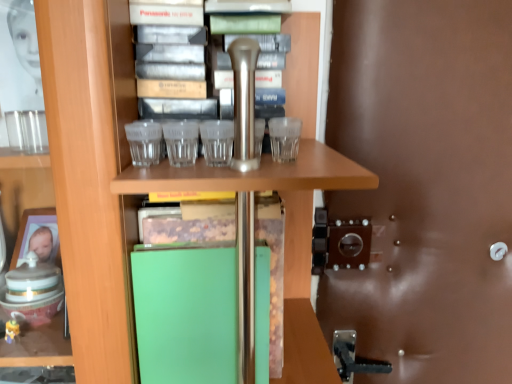
The width and height of the screenshot is (512, 384). What do you see at coordinates (263, 189) in the screenshot?
I see `green matte folder at center` at bounding box center [263, 189].

This screenshot has width=512, height=384. Identify the location of green matte folder at center. (263, 189).

Locate an element on the screen. The height and width of the screenshot is (384, 512). brown leather door at right is located at coordinates [425, 186].

This screenshot has width=512, height=384. What do you see at coordinates (425, 186) in the screenshot?
I see `brown leather door at right` at bounding box center [425, 186].

You are a GUI agent. You are given a task and a screenshot of the screen. Output one action in this format:
    pyautogui.click(x=<x>, y=<y>)
    Task: Click on the green matte folder at center
    
    Given the screenshot: What is the action you would take?
    pyautogui.click(x=263, y=189)

Considering the positions of objects green matte folder at center and brown leather door at right in the image provided, who is more to the left, green matte folder at center or brown leather door at right?

green matte folder at center is more to the left.

Between green matte folder at center and brown leather door at right, which one is positioned in front?

Positioned in front is green matte folder at center.

Considering the points (290, 255) and (468, 263), which point is behind, point (290, 255) or point (468, 263)?

Point (468, 263)

From the image's perspective, is green matte folder at center positioned above or below brown leather door at right?

Based on their image positions, green matte folder at center is located beneath brown leather door at right.

From a real-world perspective, who is located lower, green matte folder at center or brown leather door at right?

green matte folder at center.

Does green matte folder at center have a greater width compared to brown leather door at right?

Yes.

Is green matte folder at center taller or shorter than brown leather door at right?

Clearly, green matte folder at center is shorter compared to brown leather door at right.

Which of these two, green matte folder at center or brown leather door at right, is bigger?

brown leather door at right is bigger.

Is green matte folder at center inside the boundaries of brown leather door at right, or outside?

green matte folder at center lies outside brown leather door at right.

Are green matte folder at center and brown leather door at right far apart?

green matte folder at center is near brown leather door at right, not far away.

Is green matte folder at center facing away from brown leather door at right?

No, green matte folder at center's orientation is not away from brown leather door at right.

How different are the orientations of green matte folder at center and brown leather door at right in degrees?

The angle between the facing direction of green matte folder at center and the facing direction of brown leather door at right is 2.25 degrees.

Identify the location of glass door on the right of green matte folder at center. (425, 186).

Which is more to the right, brown leather door at right or green matte folder at center?

From the viewer's perspective, brown leather door at right appears more on the right side.

Does brown leather door at right come behind green matte folder at center?

Yes, brown leather door at right is further from the camera.

Is point (510, 68) closer to camera compared to point (129, 185)?

No, (510, 68) is further to viewer.

From the image's perspective, is brown leather door at right located above or below green matte folder at center?

Based on their image positions, brown leather door at right is located above green matte folder at center.

From a real-world perspective, is brown leather door at right positioned over green matte folder at center based on gravity?

Yes.

Between brown leather door at right and green matte folder at center, which one has smaller width?

brown leather door at right is thinner.

Is brown leather door at right shorter than green matte folder at center?

No, brown leather door at right is not shorter than green matte folder at center.

Who is smaller, brown leather door at right or green matte folder at center?

green matte folder at center.

Is brown leather door at right situated inside green matte folder at center or outside?

brown leather door at right is not enclosed by green matte folder at center.

Is brown leather door at right not near green matte folder at center?

No, brown leather door at right is not far away from green matte folder at center.

Is brown leather door at right turned away from green matte folder at center?

No, green matte folder at center is not at the back of brown leather door at right.

What's the angular difference between brown leather door at right and green matte folder at center's facing directions?

There is a 2.25-degree angle between the facing directions of brown leather door at right and green matte folder at center.

At what (x,y) coordinates should I click in order to perform the action: click on glass door lying on the right of green matte folder at center. Please return your answer as a coordinate pair (x, y). The height and width of the screenshot is (384, 512). Looking at the image, I should click on (425, 186).

What are the coordinates of `table located on the left of brown leather door at right` in the screenshot? It's located at (263, 189).

In order to click on glass door above the green matte folder at center (from a real-world perspective) in this screenshot , I will do `click(425, 186)`.